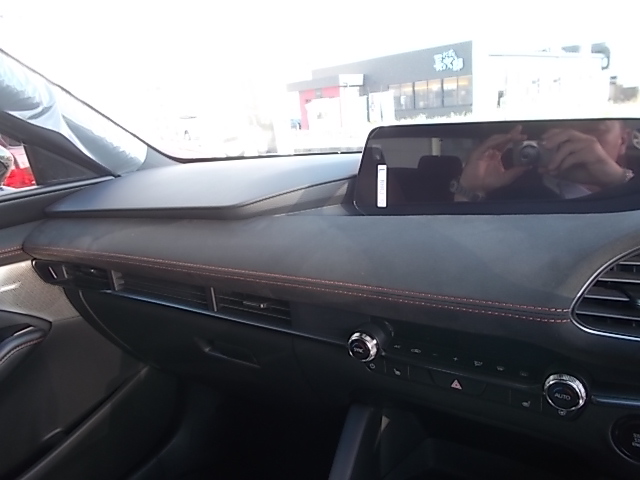
This screenshot has width=640, height=480. I want to click on side window, so click(x=19, y=174).